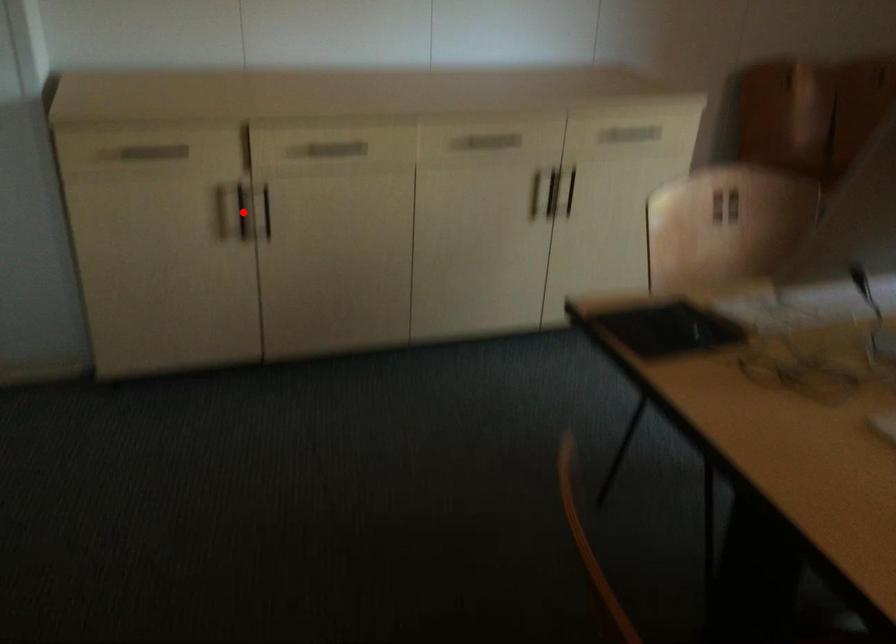
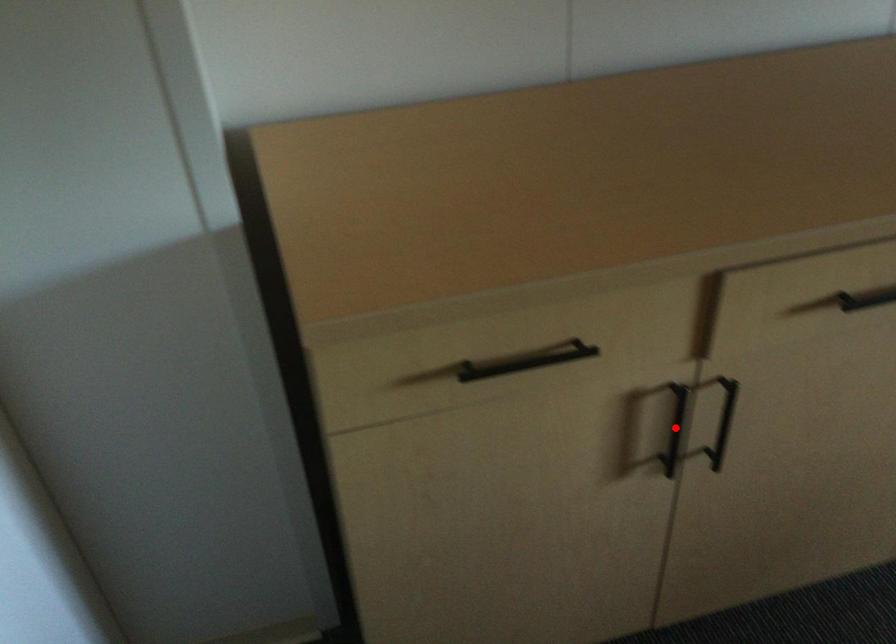
I am providing you with two images of the same scene from different viewpoints. A red point is marked on the first image and another point is marked on the second image. Is the red point in image1 aligned with the point shown in image2?

Yes